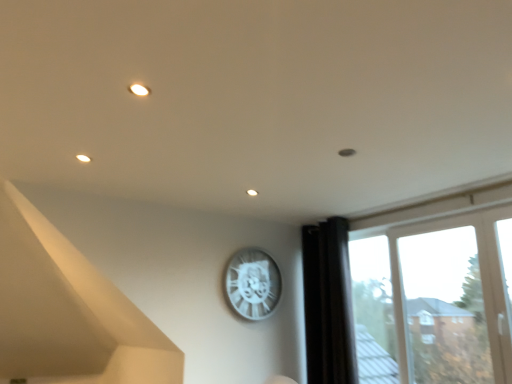
Question: Considering the relative sizes of white metallic clock at upper center and transparent glass window at right in the image provided, is white metallic clock at upper center shorter than transparent glass window at right?

Choices:
 (A) no
 (B) yes

Answer: (B)

Question: Considering the relative positions of white metallic clock at upper center and transparent glass window at right in the image provided, is white metallic clock at upper center to the left of transparent glass window at right from the viewer's perspective?

Choices:
 (A) no
 (B) yes

Answer: (B)

Question: Can you confirm if white metallic clock at upper center is wider than transparent glass window at right?

Choices:
 (A) no
 (B) yes

Answer: (A)

Question: From the image's perspective, would you say white metallic clock at upper center is positioned over transparent glass window at right?

Choices:
 (A) yes
 (B) no

Answer: (A)

Question: Is white metallic clock at upper center directly adjacent to transparent glass window at right?

Choices:
 (A) no
 (B) yes

Answer: (A)

Question: Choose the correct answer: Is transparent glass window at right inside black fabric curtain at right or outside it?

Choices:
 (A) inside
 (B) outside

Answer: (B)

Question: From a real-world perspective, is transparent glass window at right physically located above or below black fabric curtain at right?

Choices:
 (A) above
 (B) below

Answer: (B)

Question: Based on their sizes in the image, would you say transparent glass window at right is bigger or smaller than black fabric curtain at right?

Choices:
 (A) big
 (B) small

Answer: (A)

Question: Does point (481, 322) appear closer or farther from the camera than point (311, 349)?

Choices:
 (A) farther
 (B) closer

Answer: (B)

Question: Is black fabric curtain at right in front of or behind transparent glass window at right in the image?

Choices:
 (A) front
 (B) behind

Answer: (B)

Question: In terms of height, does black fabric curtain at right look taller or shorter compared to transparent glass window at right?

Choices:
 (A) short
 (B) tall

Answer: (B)

Question: From a real-world perspective, is black fabric curtain at right positioned above or below transparent glass window at right?

Choices:
 (A) above
 (B) below

Answer: (A)

Question: Do you think black fabric curtain at right is within transparent glass window at right, or outside of it?

Choices:
 (A) outside
 (B) inside

Answer: (A)

Question: In the image, is black fabric curtain at right positioned in front of or behind white metallic clock at upper center?

Choices:
 (A) front
 (B) behind

Answer: (A)

Question: From a real-world perspective, is black fabric curtain at right physically located above or below white metallic clock at upper center?

Choices:
 (A) below
 (B) above

Answer: (A)